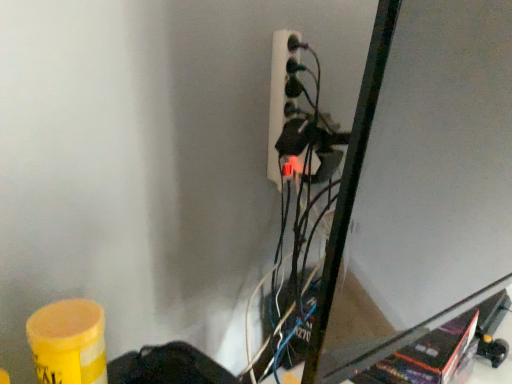
Question: Visually, is yellow matte barrel at lower left positioned to the left or to the right of white plastic power plugs and sockets at upper center?

Choices:
 (A) left
 (B) right

Answer: (A)

Question: Is yellow matte barrel at lower left in front of or behind white plastic power plugs and sockets at upper center in the image?

Choices:
 (A) front
 (B) behind

Answer: (A)

Question: Would you say yellow matte barrel at lower left is inside or outside white plastic power plugs and sockets at upper center?

Choices:
 (A) outside
 (B) inside

Answer: (A)

Question: Is white plastic power plugs and sockets at upper center wider or thinner than yellow matte barrel at lower left?

Choices:
 (A) wide
 (B) thin

Answer: (B)

Question: From a real-world perspective, is white plastic power plugs and sockets at upper center physically located above or below yellow matte barrel at lower left?

Choices:
 (A) below
 (B) above

Answer: (B)

Question: From the image's perspective, is white plastic power plugs and sockets at upper center located above or below yellow matte barrel at lower left?

Choices:
 (A) above
 (B) below

Answer: (A)

Question: Is white plastic power plugs and sockets at upper center spatially inside yellow matte barrel at lower left, or outside of it?

Choices:
 (A) inside
 (B) outside

Answer: (B)